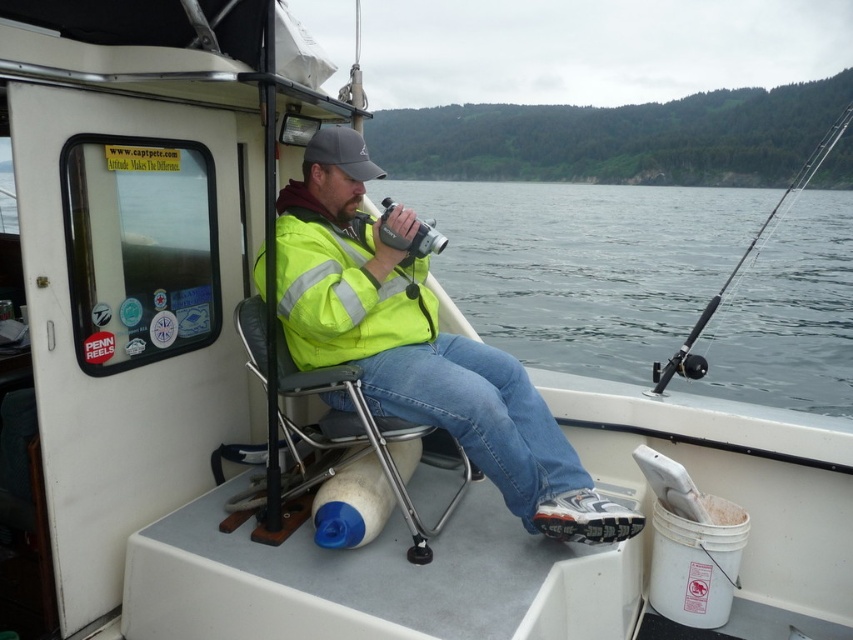
Can you confirm if yellow reflective jacket at center is taller than metallic gray chair at center?

Indeed, yellow reflective jacket at center has a greater height compared to metallic gray chair at center.

Between yellow reflective jacket at center and metallic gray chair at center, which one appears on the left side from the viewer's perspective?

From the viewer's perspective, metallic gray chair at center appears more on the left side.

What do you see at coordinates (419, 346) in the screenshot? I see `yellow reflective jacket at center` at bounding box center [419, 346].

The width and height of the screenshot is (853, 640). I want to click on yellow reflective jacket at center, so click(419, 346).

Who is lower down, yellow reflective jacket at center or black plastic fishing pole at right?

yellow reflective jacket at center is below.

Who is taller, yellow reflective jacket at center or black plastic fishing pole at right?

black plastic fishing pole at right

What do you see at coordinates (419, 346) in the screenshot?
I see `yellow reflective jacket at center` at bounding box center [419, 346].

In order to click on yellow reflective jacket at center in this screenshot , I will do `click(419, 346)`.

Is gray water at center shorter than metallic gray chair at center?

Incorrect, gray water at center's height does not fall short of metallic gray chair at center's.

Which of these two, gray water at center or metallic gray chair at center, stands shorter?

metallic gray chair at center is shorter.

Which is in front, point (706, 237) or point (389, 492)?

Point (389, 492) is in front.

Identify the location of gray water at center. This screenshot has width=853, height=640. (583, 264).